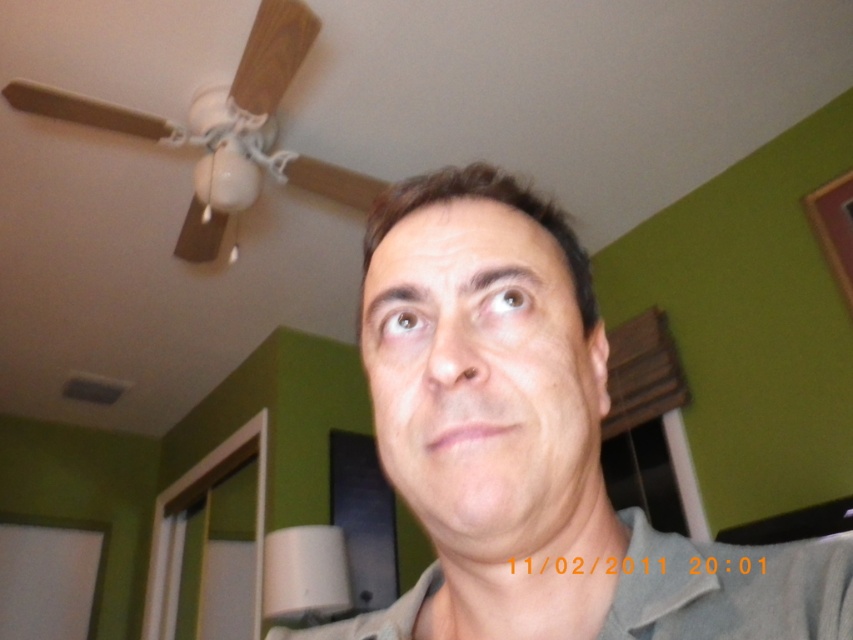
Question: Which point is farther to the camera?

Choices:
 (A) gray matte shirt at center
 (B) smooth skin face at center

Answer: (A)

Question: Can you confirm if gray matte shirt at center is smaller than smooth skin face at center?

Choices:
 (A) yes
 (B) no

Answer: (B)

Question: Does gray matte shirt at center have a greater width compared to smooth skin face at center?

Choices:
 (A) no
 (B) yes

Answer: (B)

Question: Is gray matte shirt at center to the left of smooth skin face at center from the viewer's perspective?

Choices:
 (A) no
 (B) yes

Answer: (B)

Question: Among these objects, which one is farthest from the camera?

Choices:
 (A) smooth skin face at center
 (B) gray matte shirt at center

Answer: (B)